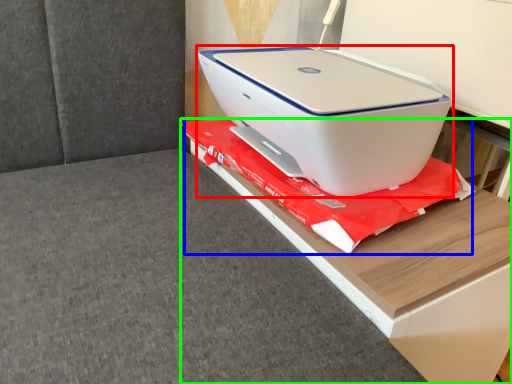
Question: Estimate the real-world distances between objects in this image. Which object is farther from printer (highlighted by a red box), material (highlighted by a blue box) or furniture (highlighted by a green box)?

Choices:
 (A) material
 (B) furniture

Answer: (B)